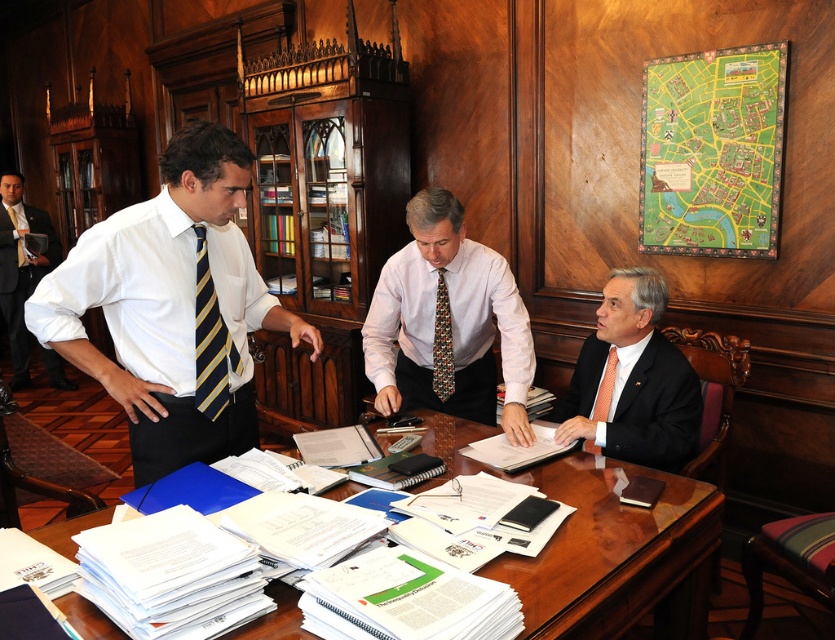
Question: Which point is farther to the camera?

Choices:
 (A) white shirt with striped tie at left
 (B) wooden at center
 (C) matte black suit at right

Answer: (C)

Question: Which point appears farthest from the camera in this image?

Choices:
 (A) (9, 212)
 (B) (413, 259)
 (C) (64, 332)

Answer: (A)

Question: Which of these objects is positioned farthest from the patterned silk tie at center?

Choices:
 (A) white shirt with striped tie at left
 (B) matte black suit at right
 (C) striped silk tie at left

Answer: (C)

Question: Is white shirt with striped tie at left further to the viewer compared to wooden at center?

Choices:
 (A) yes
 (B) no

Answer: (A)

Question: Is multicolored woven tie at center closer to camera compared to striped silk tie at left?

Choices:
 (A) no
 (B) yes

Answer: (B)

Question: Is the position of yellow and blue striped tie at left less distant than that of striped silk tie at left?

Choices:
 (A) no
 (B) yes

Answer: (B)